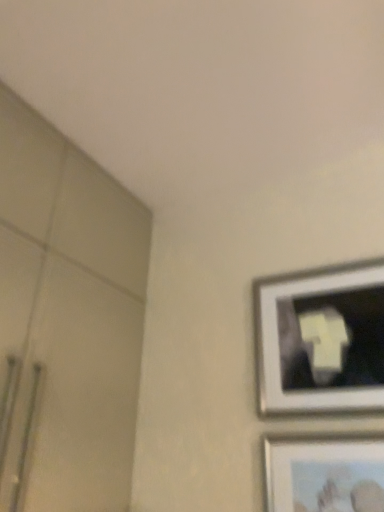
Question: Should I look upward or downward to see matte silver picture frame at lower right, the first picture frame ordered from the bottom?

Choices:
 (A) down
 (B) up

Answer: (A)

Question: Does metallic silver picture frame at upper right, the 2th picture frame when ordered from bottom to top, have a greater height compared to matte silver picture frame at lower right, the first picture frame ordered from the bottom?

Choices:
 (A) no
 (B) yes

Answer: (B)

Question: Considering the relative sizes of metallic silver picture frame at upper right, the 2th picture frame when ordered from bottom to top, and matte silver picture frame at lower right, the first picture frame ordered from the bottom, in the image provided, is metallic silver picture frame at upper right, the 2th picture frame when ordered from bottom to top, smaller than matte silver picture frame at lower right, the first picture frame ordered from the bottom,?

Choices:
 (A) yes
 (B) no

Answer: (B)

Question: Is metallic silver picture frame at upper right, the 2th picture frame when ordered from bottom to top, thinner than matte silver picture frame at lower right, positioned as the second picture frame in top-to-bottom order?

Choices:
 (A) yes
 (B) no

Answer: (B)

Question: From the image's perspective, is metallic silver picture frame at upper right, which is counted as the 1th picture frame, starting from the top, under matte silver picture frame at lower right, positioned as the second picture frame in top-to-bottom order?

Choices:
 (A) no
 (B) yes

Answer: (A)

Question: Is metallic silver picture frame at upper right, which is counted as the 1th picture frame, starting from the top, further to camera compared to matte silver picture frame at lower right, positioned as the second picture frame in top-to-bottom order?

Choices:
 (A) no
 (B) yes

Answer: (B)

Question: Considering the relative positions of metallic silver picture frame at upper right, which is counted as the 1th picture frame, starting from the top, and matte silver picture frame at lower right, the first picture frame ordered from the bottom, in the image provided, is metallic silver picture frame at upper right, which is counted as the 1th picture frame, starting from the top, to the left of matte silver picture frame at lower right, the first picture frame ordered from the bottom, from the viewer's perspective?

Choices:
 (A) yes
 (B) no

Answer: (A)

Question: Can you confirm if matte silver picture frame at lower right, positioned as the second picture frame in top-to-bottom order, is positioned to the left of metallic silver picture frame at upper right, the 2th picture frame when ordered from bottom to top?

Choices:
 (A) no
 (B) yes

Answer: (A)

Question: Does matte silver picture frame at lower right, positioned as the second picture frame in top-to-bottom order, come in front of metallic silver picture frame at upper right, which is counted as the 1th picture frame, starting from the top?

Choices:
 (A) yes
 (B) no

Answer: (A)

Question: Can you confirm if matte silver picture frame at lower right, the first picture frame ordered from the bottom, is smaller than metallic silver picture frame at upper right, which is counted as the 1th picture frame, starting from the top?

Choices:
 (A) yes
 (B) no

Answer: (A)

Question: Can you see matte silver picture frame at lower right, the first picture frame ordered from the bottom, touching metallic silver picture frame at upper right, the 2th picture frame when ordered from bottom to top?

Choices:
 (A) yes
 (B) no

Answer: (B)

Question: Is matte silver picture frame at lower right, the first picture frame ordered from the bottom, far away from metallic silver picture frame at upper right, the 2th picture frame when ordered from bottom to top?

Choices:
 (A) no
 (B) yes

Answer: (A)

Question: Is matte silver picture frame at lower right, positioned as the second picture frame in top-to-bottom order, positioned with its back to metallic silver picture frame at upper right, which is counted as the 1th picture frame, starting from the top?

Choices:
 (A) no
 (B) yes

Answer: (A)

Question: Considering the positions of matte silver picture frame at lower right, the first picture frame ordered from the bottom, and metallic silver picture frame at upper right, the 2th picture frame when ordered from bottom to top, in the image, is matte silver picture frame at lower right, the first picture frame ordered from the bottom, taller or shorter than metallic silver picture frame at upper right, the 2th picture frame when ordered from bottom to top,?

Choices:
 (A) tall
 (B) short

Answer: (B)